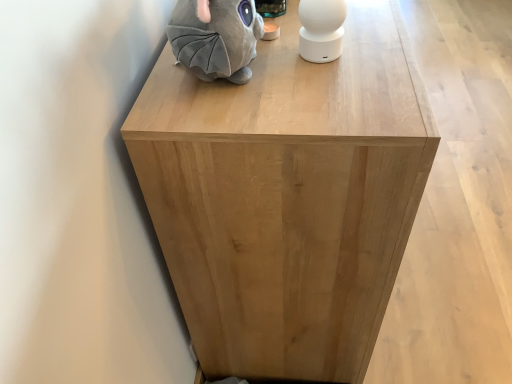
I want to click on free point to the right of gray plush toy at upper left, the first toy viewed from the left, so click(x=339, y=69).